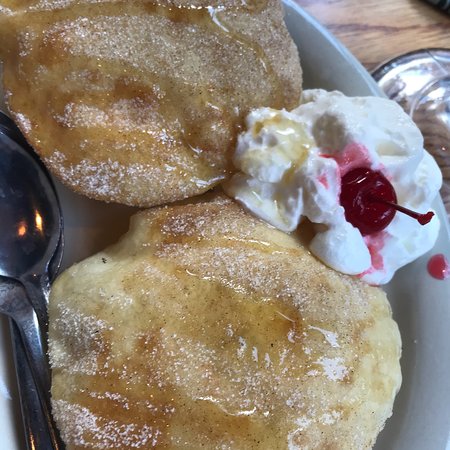
Find the location of a particular element. The height and width of the screenshot is (450, 450). spoon handle is located at coordinates (32, 426), (41, 374).